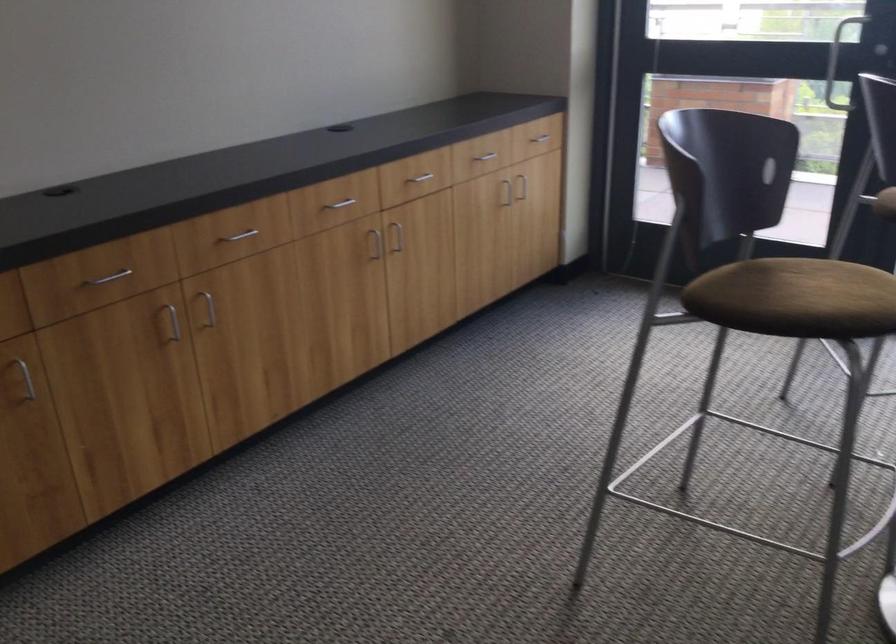
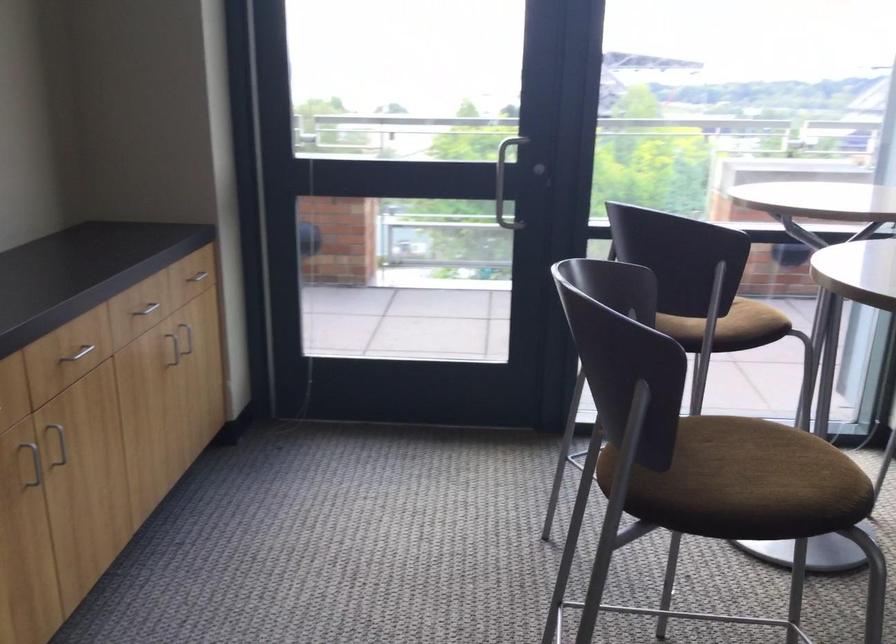
The point at (780, 301) is marked in the first image. Where is the corresponding point in the second image?

(739, 482)